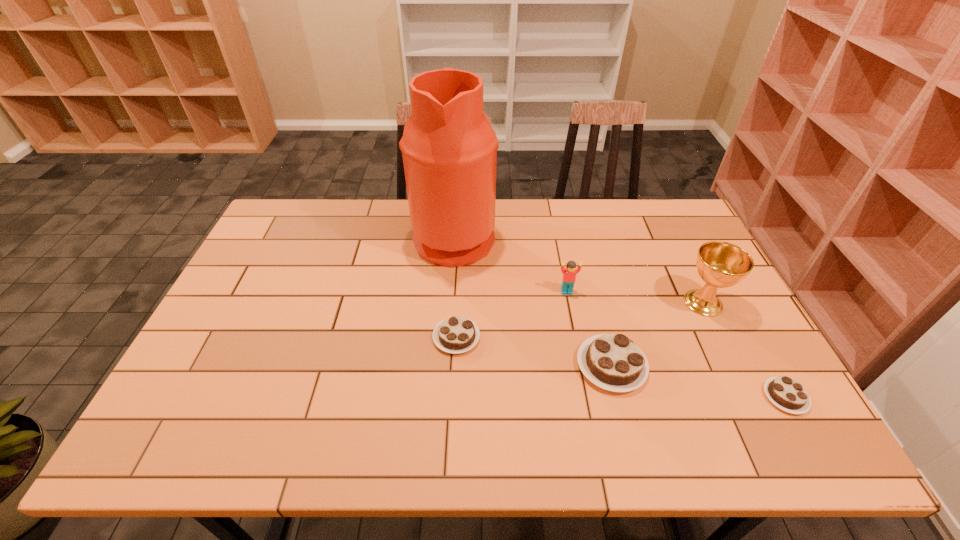
The height and width of the screenshot is (540, 960). Find the location of `the second shortest chocolate cake`. the second shortest chocolate cake is located at coordinates (457, 334).

Find the location of a particular element. the leftmost chocolate cake is located at coordinates (457, 334).

Locate an element on the screen. This screenshot has height=540, width=960. the third shortest object is located at coordinates (613, 362).

This screenshot has width=960, height=540. I want to click on the tallest chocolate cake, so click(x=613, y=362).

At what (x,y) coordinates should I click in order to perform the action: click on the rightmost chocolate cake. Please return your answer as a coordinate pair (x, y). This screenshot has height=540, width=960. Looking at the image, I should click on (786, 393).

The height and width of the screenshot is (540, 960). Identify the location of the shortest chocolate cake. (786, 393).

Where is `the tallest object`? the tallest object is located at coordinates (449, 148).

This screenshot has width=960, height=540. Find the location of `water jug`. water jug is located at coordinates (449, 148).

I want to click on chalice, so click(x=720, y=264).

The height and width of the screenshot is (540, 960). In order to click on the third tallest object in this screenshot , I will do `click(569, 274)`.